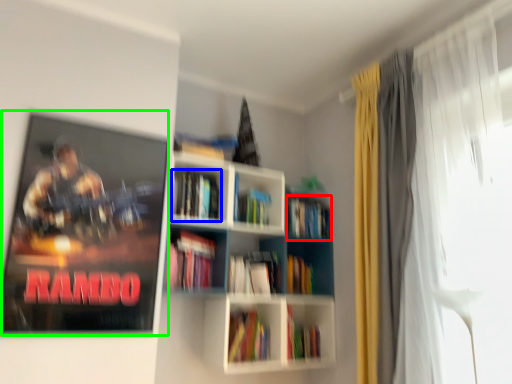
Question: Which is farther away from book (highlighted by a red box)? book (highlighted by a blue box) or movie poster (highlighted by a green box)?

Choices:
 (A) book
 (B) movie poster

Answer: (B)